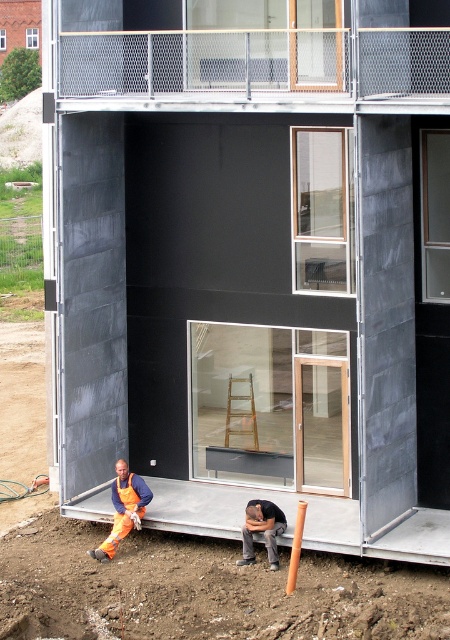
Consider the image. You are a construction supervisor checking the site. You notice two workers in the area. One is wearing dark gray fabric pants at lower center and another in orange fabric safety vest at lower left. Which worker is positioned lower in elevation?

The dark gray fabric pants at lower center is located below the orange fabric safety vest at lower left, meaning the worker in dark gray fabric pants at lower center is positioned lower in elevation.

Looking at this image, you are a construction supervisor checking the site. You notice the orange coveralls at lower left and the dark gray fabric pants at lower center. Which worker is positioned higher in elevation?

The orange coveralls at lower left is above dark gray fabric pants at lower center, so the worker in orange coveralls at lower left is positioned higher.